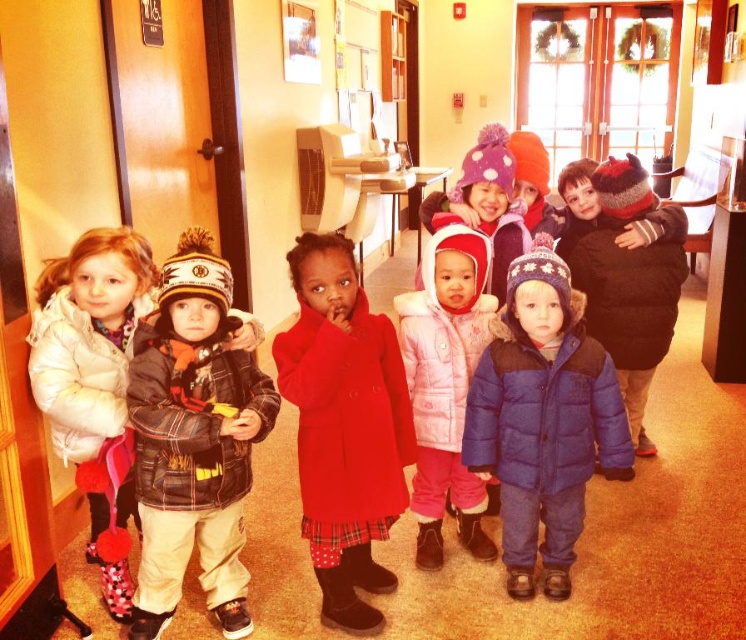
Question: Can you confirm if matte black jacket at center is positioned below pink fleece coat at center?

Choices:
 (A) no
 (B) yes

Answer: (B)

Question: Among these points, which one is nearest to the camera?

Choices:
 (A) (495, 152)
 (B) (333, 268)
 (C) (448, 241)

Answer: (B)

Question: Is blue puffy coat at center wider than pink fleece coat at center?

Choices:
 (A) yes
 (B) no

Answer: (A)

Question: Which point is closer to the camera?

Choices:
 (A) (473, 177)
 (B) (327, 428)
 (C) (524, 529)

Answer: (B)

Question: Does velvet red coat at center lie behind blue puffy coat at center?

Choices:
 (A) yes
 (B) no

Answer: (B)

Question: Estimate the real-world distances between objects in this image. Which object is closer to the blue puffy coat at center?

Choices:
 (A) velvet red coat at center
 (B) matte black jacket at center
 (C) pink fleece coat at center
 (D) purple fuzzy hat at center

Answer: (C)